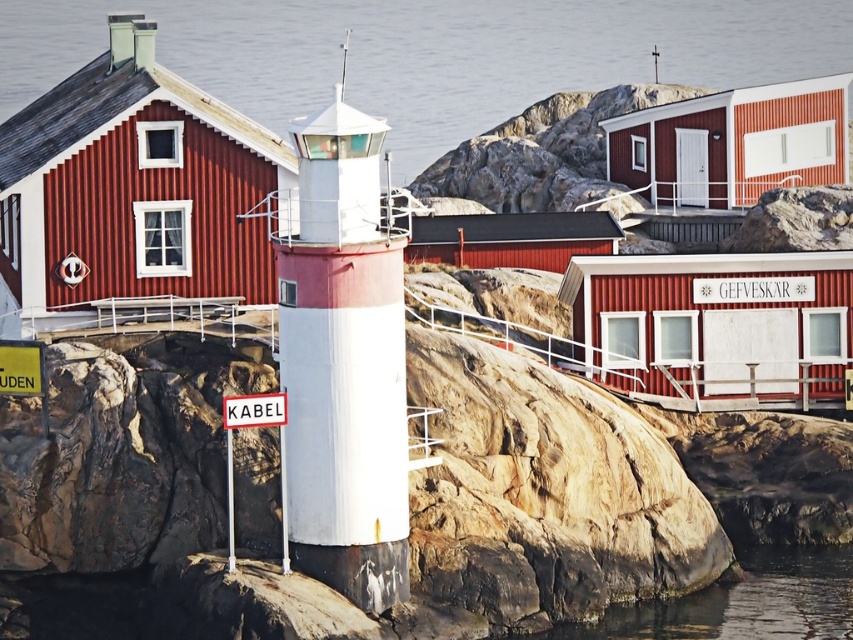
You are standing at the lighthouse and looking out towards the sea. There are two points marked on the ground in front of you. One is at point coordinates point (x=813, y=122) and the other is at point coordinates point (x=265, y=394). Which point is closer to you?

Point point (x=813, y=122) is closer to you because it is further to the viewer than point point (x=265, y=394).

You are a drone operator trying to capture aerial shots of the coastal scene. You have two markers labeled point 1 and point 2 placed at coordinates point 1 at point [640,186] and point 2 at point [776,288]. You want to ensure that point 1 stays visible in the frame while moving the drone towards point 2. Based on the scene, will point 1 remain visible behind point 2 as you move the drone closer to point 2?

Point 1 at point [640,186] is behind point 2 at point [776,288], so as you move the drone closer to point 2, point 1 will remain visible behind point 2 in the frame.